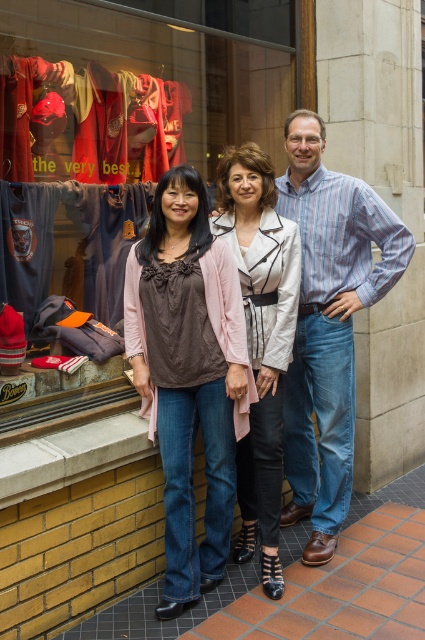
Is matte brown blouse at center bigger than matte white jacket at center?

No, matte brown blouse at center is not bigger than matte white jacket at center.

Can you confirm if matte brown blouse at center is shorter than matte white jacket at center?

Correct, matte brown blouse at center is not as tall as matte white jacket at center.

This screenshot has width=425, height=640. Describe the element at coordinates (187, 372) in the screenshot. I see `matte brown blouse at center` at that location.

You are a GUI agent. You are given a task and a screenshot of the screen. Output one action in this format:
    pyautogui.click(x=<x>, y=<y>)
    Task: Click on the matte brown blouse at center
    The image size is (425, 640).
    Given the screenshot: What is the action you would take?
    pyautogui.click(x=187, y=372)

Is matte brown blouse at center below blue striped shirt at center?

Indeed, matte brown blouse at center is positioned under blue striped shirt at center.

Does matte brown blouse at center lie in front of blue striped shirt at center?

Yes, matte brown blouse at center is closer to the viewer.

At what (x,y) coordinates should I click in order to perform the action: click on matte brown blouse at center. Please return your answer as a coordinate pair (x, y). The height and width of the screenshot is (640, 425). Looking at the image, I should click on (187, 372).

Does point (365, 285) come in front of point (274, 284)?

No, (365, 285) is behind (274, 284).

Measure the distance between blue striped shirt at center and camera.

The distance of blue striped shirt at center from camera is 10.00 feet.

I want to click on blue striped shirt at center, so click(328, 323).